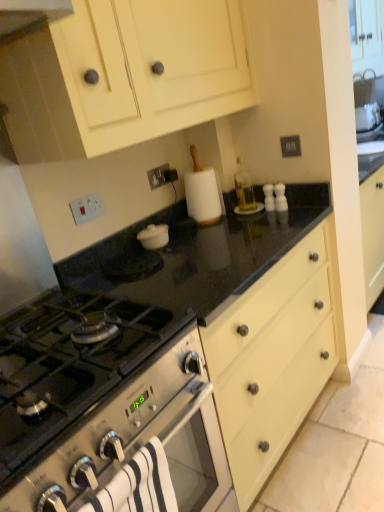
Question: Is stainless steel gas stove at lower left far away from white striped towel at lower left?

Choices:
 (A) yes
 (B) no

Answer: (B)

Question: From the image's perspective, is stainless steel gas stove at lower left under white striped towel at lower left?

Choices:
 (A) yes
 (B) no

Answer: (B)

Question: Is white striped towel at lower left inside stainless steel gas stove at lower left?

Choices:
 (A) yes
 (B) no

Answer: (B)

Question: Considering the relative sizes of stainless steel gas stove at lower left and white striped towel at lower left in the image provided, is stainless steel gas stove at lower left thinner than white striped towel at lower left?

Choices:
 (A) yes
 (B) no

Answer: (B)

Question: Can you confirm if stainless steel gas stove at lower left is shorter than white striped towel at lower left?

Choices:
 (A) yes
 (B) no

Answer: (A)

Question: Considering the relative sizes of stainless steel gas stove at lower left and white striped towel at lower left in the image provided, is stainless steel gas stove at lower left wider than white striped towel at lower left?

Choices:
 (A) yes
 (B) no

Answer: (A)

Question: Is stainless steel gas stove at lower left positioned with its back to matte cream cabinet at upper center?

Choices:
 (A) yes
 (B) no

Answer: (B)

Question: Is stainless steel gas stove at lower left at the right side of matte cream cabinet at upper center?

Choices:
 (A) yes
 (B) no

Answer: (B)

Question: From the image's perspective, is stainless steel gas stove at lower left on top of matte cream cabinet at upper center?

Choices:
 (A) yes
 (B) no

Answer: (B)

Question: Could you tell me if stainless steel gas stove at lower left is facing matte cream cabinet at upper center?

Choices:
 (A) no
 (B) yes

Answer: (A)

Question: From a real-world perspective, is stainless steel gas stove at lower left positioned over matte cream cabinet at upper center based on gravity?

Choices:
 (A) yes
 (B) no

Answer: (B)

Question: Is stainless steel gas stove at lower left bigger than matte cream cabinet at upper center?

Choices:
 (A) yes
 (B) no

Answer: (B)

Question: Are black granite countertop at center and matte cream cabinet at upper center beside each other?

Choices:
 (A) no
 (B) yes

Answer: (A)